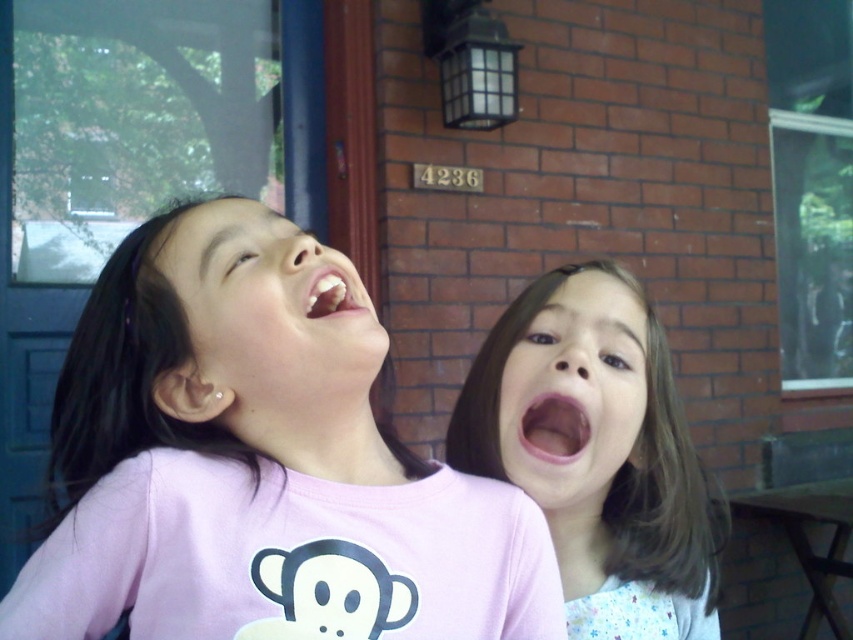
From the picture: Does pink matte shirt at upper left have a greater height compared to pink glossy mouth at center right?

Yes.

Locate an element on the screen. This screenshot has width=853, height=640. pink matte shirt at upper left is located at coordinates (265, 307).

Who is more distant from viewer, (183, 372) or (544, 449)?

Positioned behind is point (544, 449).

I want to click on pink matte shirt at upper left, so click(x=265, y=307).

How far apart are pink matte shirt at center and white glossy teeth at center?

pink matte shirt at center and white glossy teeth at center are 5.78 inches apart.

Is point (305, 506) in front of point (315, 280)?

Yes, it is.

The width and height of the screenshot is (853, 640). In order to click on pink matte shirt at center in this screenshot , I will do `click(258, 465)`.

Does pink matte shirt at center have a greater width compared to pink glossy mouth at center right?

Correct, the width of pink matte shirt at center exceeds that of pink glossy mouth at center right.

Does point (200, 214) lie behind point (548, 433)?

No, it is in front of (548, 433).

This screenshot has height=640, width=853. In order to click on pink matte shirt at center in this screenshot , I will do `click(258, 465)`.